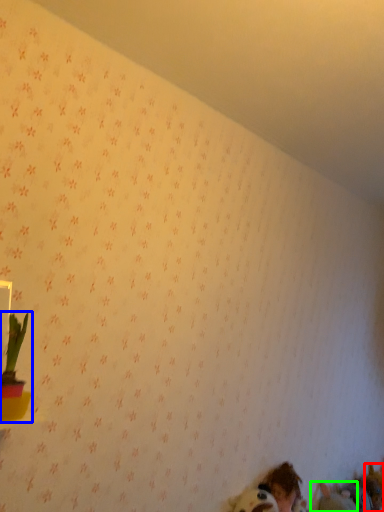
Question: Which is farther away from animal (highlighted by a red box)? houseplant (highlighted by a blue box) or animal (highlighted by a green box)?

Choices:
 (A) houseplant
 (B) animal

Answer: (A)